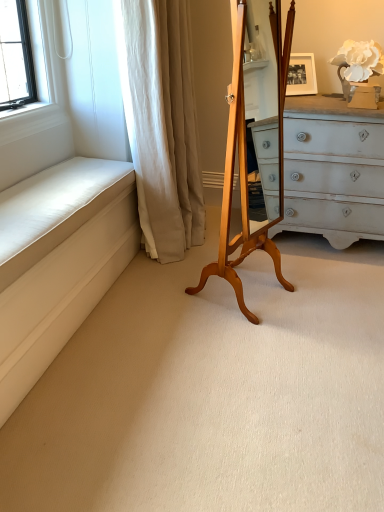
Locate an element on the screen. This screenshot has width=384, height=512. light brown wood easel at center is located at coordinates (246, 159).

What is the approximate width of light brown wood easel at center?

It is 42.78 centimeters.

You are a GUI agent. You are given a task and a screenshot of the screen. Output one action in this format:
    pyautogui.click(x=<x>, y=<y>)
    Task: Click on the white matte flower at upper right
    The image size is (384, 512).
    Given the screenshot: What is the action you would take?
    pyautogui.click(x=359, y=60)

Locate an element on the screen. The width and height of the screenshot is (384, 512). light brown wood easel at center is located at coordinates (246, 159).

Is white matte flower at upper right facing away from white fabric curtain at left?

No.

Is point (346, 63) positioned before point (119, 48)?

No, (346, 63) is further to viewer.

In the scene shown: Visually, is white matte flower at upper right positioned to the left or to the right of white fabric curtain at left?

white matte flower at upper right is positioned on white fabric curtain at left's right side.

Can you confirm if white matte flower at upper right is bigger than white fabric curtain at left?

No, white matte flower at upper right is not bigger than white fabric curtain at left.

Find the location of `flower above the white fabric curtain at left (from the image's perspective)`. flower above the white fabric curtain at left (from the image's perspective) is located at coordinates (359, 60).

Does white fabric curtain at left come behind white matte flower at upper right?

No, it is in front of white matte flower at upper right.

Which is more to the right, white fabric curtain at left or white matte flower at upper right?

From the viewer's perspective, white matte flower at upper right appears more on the right side.

Can you confirm if light brown wood easel at center is wider than white matte flower at upper right?

Yes, light brown wood easel at center is wider than white matte flower at upper right.

From the image's perspective, relative to white matte flower at upper right, is light brown wood easel at center above or below?

Clearly, from the image's perspective, light brown wood easel at center is below white matte flower at upper right.

Is light brown wood easel at center oriented towards white matte flower at upper right?

No, light brown wood easel at center does not turn towards white matte flower at upper right.

Is light brown wood easel at center inside the boundaries of white matte flower at upper right, or outside?

light brown wood easel at center lies outside white matte flower at upper right.

Is white fabric curtain at left looking in the opposite direction of light brown wood easel at center?

white fabric curtain at left does not have its back to light brown wood easel at center.

From a real-world perspective, is white fabric curtain at left physically located above or below light brown wood easel at center?

From a real-world perspective, white fabric curtain at left is physically above light brown wood easel at center.

Can you confirm if white fabric curtain at left is positioned to the right of light brown wood easel at center?

Incorrect, white fabric curtain at left is not on the right side of light brown wood easel at center.

Is light brown wood easel at center next to white fabric curtain at left?

No, light brown wood easel at center is not touching white fabric curtain at left.

Considering the sizes of objects light brown wood easel at center and white fabric curtain at left in the image provided, who is wider, light brown wood easel at center or white fabric curtain at left?

white fabric curtain at left is wider.

Is light brown wood easel at center further to the viewer compared to white fabric curtain at left?

No, light brown wood easel at center is closer to the viewer.

Considering the sizes of objects white matte flower at upper right and light brown wood easel at center in the image provided, who is thinner, white matte flower at upper right or light brown wood easel at center?

white matte flower at upper right.

Between point (360, 42) and point (223, 255), which one is positioned in front?

The point (223, 255) is in front.

Can you confirm if white matte flower at upper right is positioned to the left of light brown wood easel at center?

In fact, white matte flower at upper right is to the right of light brown wood easel at center.

Identify the location of flower behind the white fabric curtain at left. (359, 60).

The image size is (384, 512). In order to click on curtain lying in front of the white matte flower at upper right in this screenshot , I will do `click(162, 123)`.

Based on their spatial positions, is white fabric curtain at left or white matte flower at upper right closer to light brown wood easel at center?

Based on the image, white fabric curtain at left appears to be nearer to light brown wood easel at center.

When comparing their distances from white matte flower at upper right, does light brown wood easel at center or white fabric curtain at left seem further?

white fabric curtain at left lies further to white matte flower at upper right than the other object.

Considering their positions, is white fabric curtain at left positioned further to white matte flower at upper right than light brown wood easel at center?

Among the two, white fabric curtain at left is located further to white matte flower at upper right.

When comparing their distances from light brown wood easel at center, does white matte flower at upper right or white fabric curtain at left seem further?

white matte flower at upper right is positioned further to the anchor light brown wood easel at center.

Looking at the image, which one is located further to white fabric curtain at left, light brown wood easel at center or white matte flower at upper right?

The object further to white fabric curtain at left is white matte flower at upper right.

Which object lies nearer to the anchor point white fabric curtain at left, white matte flower at upper right or light brown wood easel at center?

light brown wood easel at center is positioned closer to the anchor white fabric curtain at left.

This screenshot has width=384, height=512. What are the coordinates of `easel between white fabric curtain at left and white matte flower at upper right from left to right` in the screenshot? It's located at (246, 159).